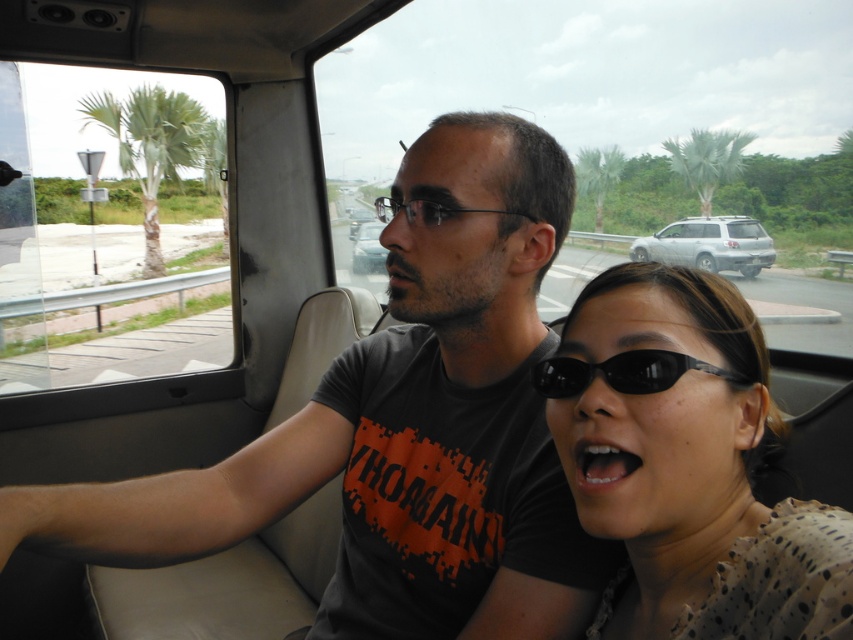
You are a passenger in the vehicle and want to point out a specific location outside the window to the driver. You notice two points marked on the window. Which point is closer to the front of the vehicle, point (482, 230) or point (126, 116)?

Point (482, 230) is in front of point (126, 116), so it is closer to the front of the vehicle.

You are a delivery driver who needs to check the GPS on your phone. You see the matte black sunglasses at center and the satin silver suv at center in your vehicle. Which object is closer to the GPS display located on the dashboard?

The matte black sunglasses at center is positioned under the satin silver suv at center, so the satin silver suv at center is closer to the GPS display on the dashboard.